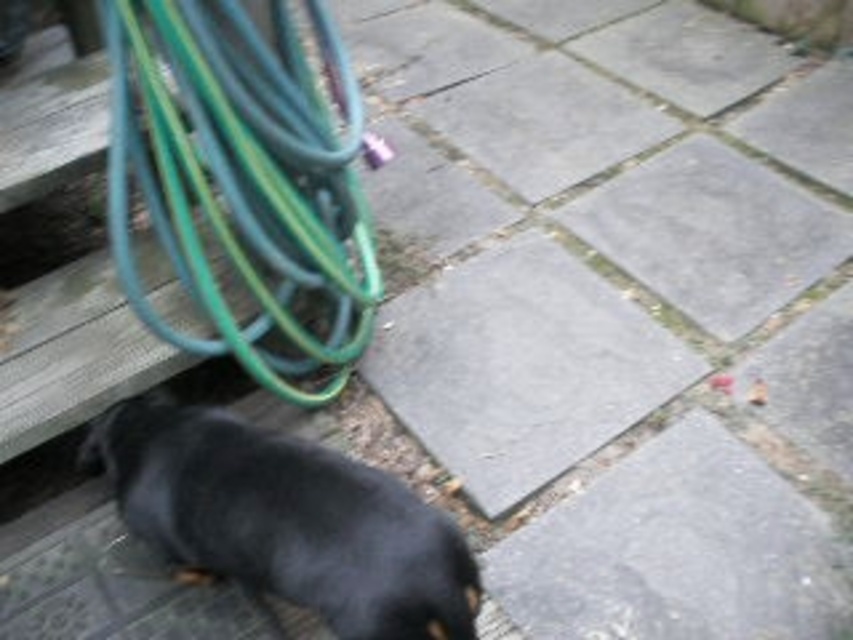
Question: Which of the following is the farthest from the observer?

Choices:
 (A) (463, 545)
 (B) (187, 172)

Answer: (B)

Question: Considering the relative positions of green rubber hose at upper left and black smooth dog at lower left in the image provided, where is green rubber hose at upper left located with respect to black smooth dog at lower left?

Choices:
 (A) below
 (B) above

Answer: (B)

Question: Is green rubber hose at upper left closer to the viewer compared to black smooth dog at lower left?

Choices:
 (A) no
 (B) yes

Answer: (A)

Question: Is green rubber hose at upper left in front of black smooth dog at lower left?

Choices:
 (A) yes
 (B) no

Answer: (B)